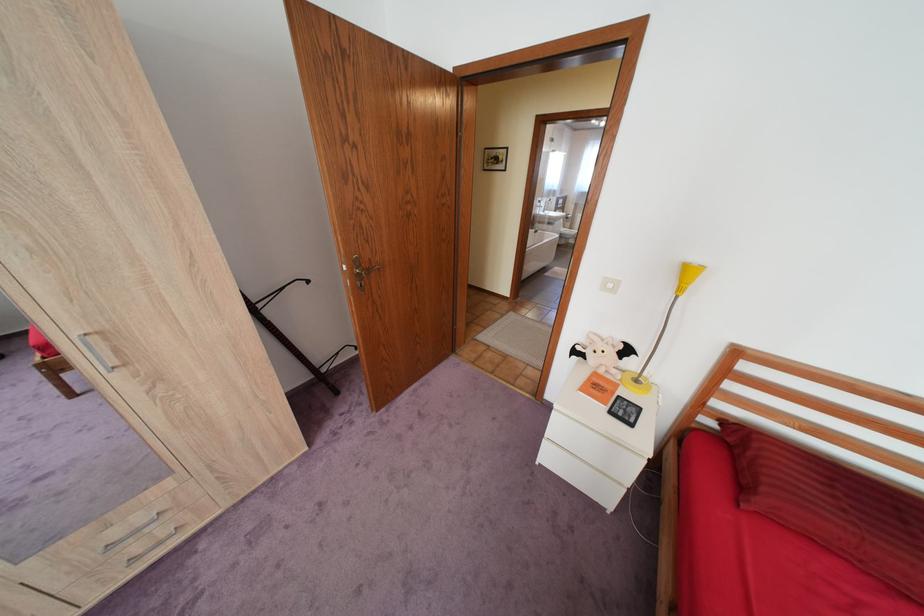
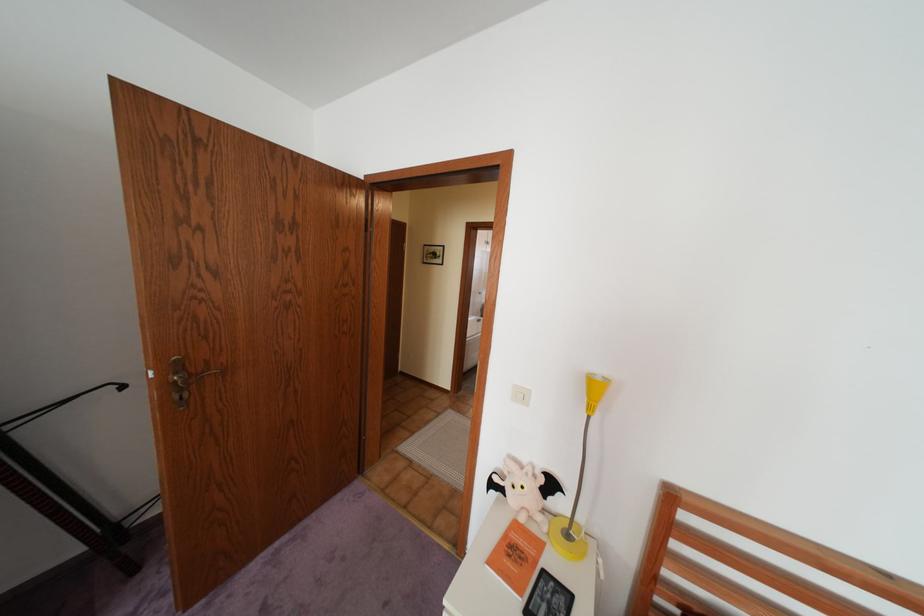
What movement of the cameraman would produce the second image?

The cameraman walked toward right, forward.